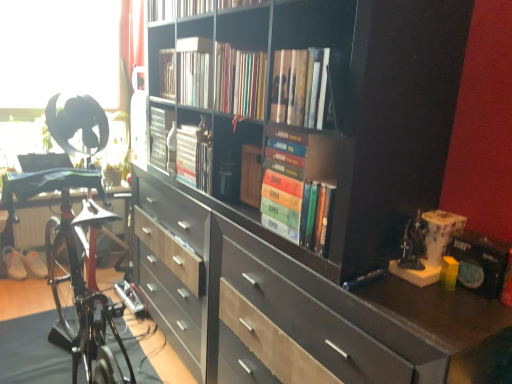
Question: Considering the positions of point (482, 276) and point (275, 51), is point (482, 276) closer or farther from the camera than point (275, 51)?

Choices:
 (A) closer
 (B) farther

Answer: (A)

Question: From their relative heights in the image, would you say matte black paperback book at right is taller or shorter than hardcover books at center, the 1th book when ordered from front to back?

Choices:
 (A) short
 (B) tall

Answer: (A)

Question: Which object is the closest to the hardcover books at center, which ranks as the 3th book in back-to-front order?

Choices:
 (A) white matte sneakers at lower left, positioned as the 2th footwear in left-to-right order
 (B) hardcover books at center, the fourth book viewed from the back
 (C) satin silver book at center, which is the second book from back to front
 (D) matte black bookcase at center
 (E) white fabric shoe at lower left, acting as the 1th footwear starting from the left

Answer: (B)

Question: Estimate the real-world distances between objects in this image. Which object is farther from the white matte sneakers at lower left, positioned as the 2th footwear in left-to-right order?

Choices:
 (A) hardcover books at center, which ranks as the 3th book in back-to-front order
 (B) white fabric shoe at lower left, arranged as the second footwear when viewed from the right
 (C) satin silver book at center, the 4th book when ordered from front to back
 (D) hardcover books at center, the fourth book viewed from the back
 (E) matte black paperback book at right

Answer: (E)